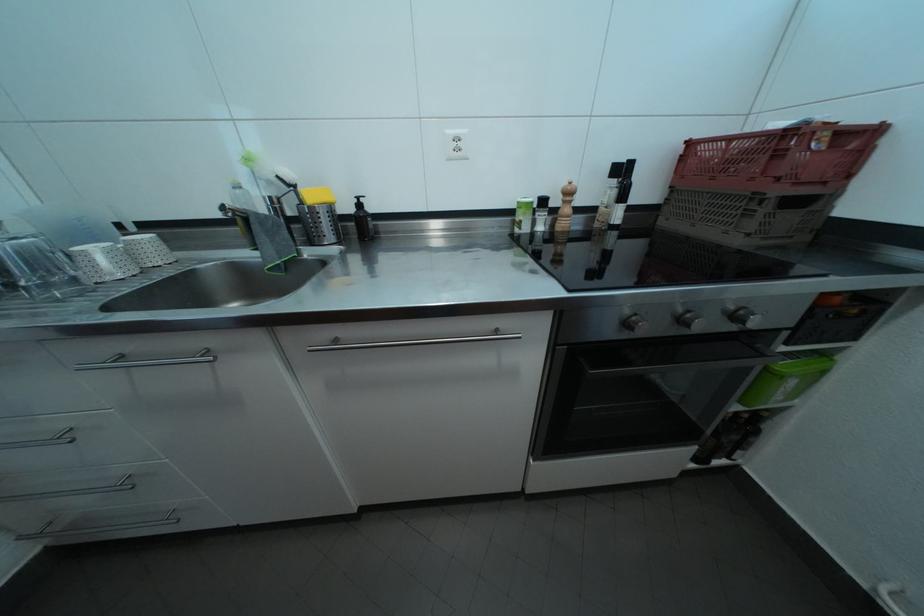
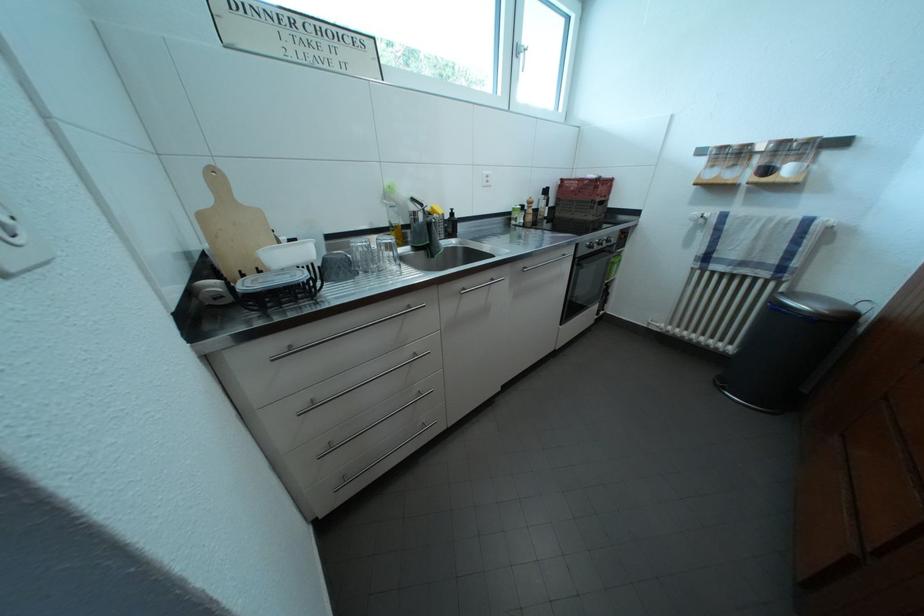
Find the pixel in the second image that matches the point at 787,161 in the first image.

(605, 193)